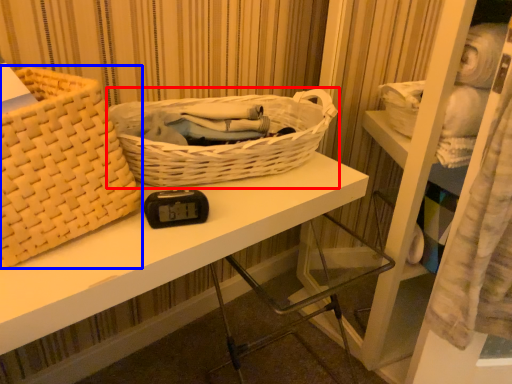
Question: Which of the following is the closest to the observer, picnic basket (highlighted by a red box) or picnic basket (highlighted by a blue box)?

Choices:
 (A) picnic basket
 (B) picnic basket

Answer: (B)